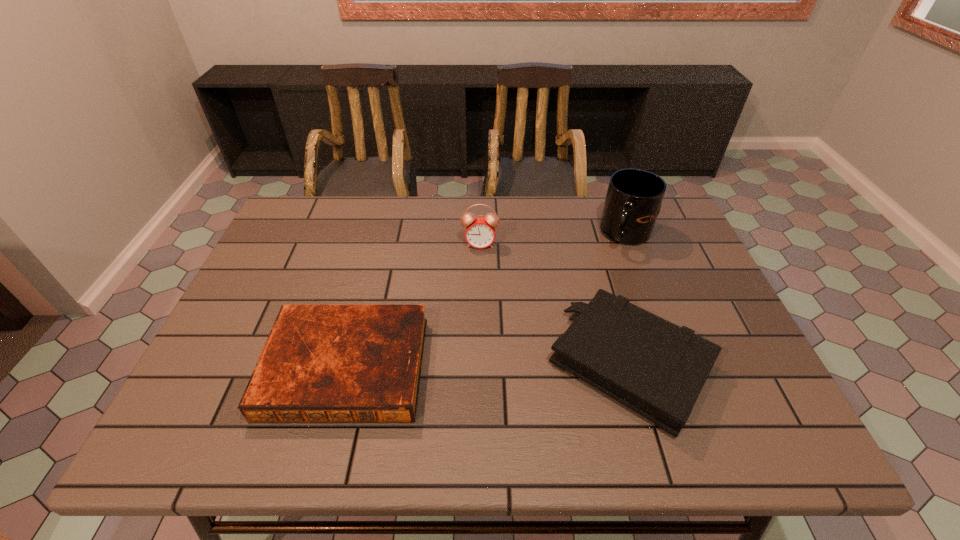
You are a GUI agent. You are given a task and a screenshot of the screen. Output one action in this format:
    pyautogui.click(x=<x>, y=<y>)
    Task: Click on the vacant space located with the handle on the side of the tallest object
    
    Given the screenshot: What is the action you would take?
    pyautogui.click(x=559, y=301)

Image resolution: width=960 pixels, height=540 pixels. I want to click on free space located on the clock face of the alarm clock, so click(471, 356).

Identify the location of vacant space situated 0.320m on the clock face of the alarm clock. (473, 336).

At what (x,y) coordinates should I click in order to perform the action: click on vacant space positioned 0.320m on the clock face of the alarm clock. Please return your answer as a coordinate pair (x, y). Image resolution: width=960 pixels, height=540 pixels. Looking at the image, I should click on (473, 336).

This screenshot has height=540, width=960. Identify the location of mug that is at the far edge. (633, 201).

Find the location of a particular element. This screenshot has height=540, width=960. alarm clock that is positioned at the far edge is located at coordinates click(x=480, y=231).

You are a GUI agent. You are given a task and a screenshot of the screen. Output one action in this format:
    pyautogui.click(x=<x>, y=<y>)
    Task: Click on the object positioned at the left edge
    This screenshot has height=540, width=960.
    Given the screenshot: What is the action you would take?
    pyautogui.click(x=321, y=363)

This screenshot has width=960, height=540. I want to click on Bible present at the right edge, so click(657, 369).

I want to click on mug located at the right edge, so click(x=633, y=201).

The height and width of the screenshot is (540, 960). Find the location of `object located at the near left corner`. object located at the near left corner is located at coordinates (321, 363).